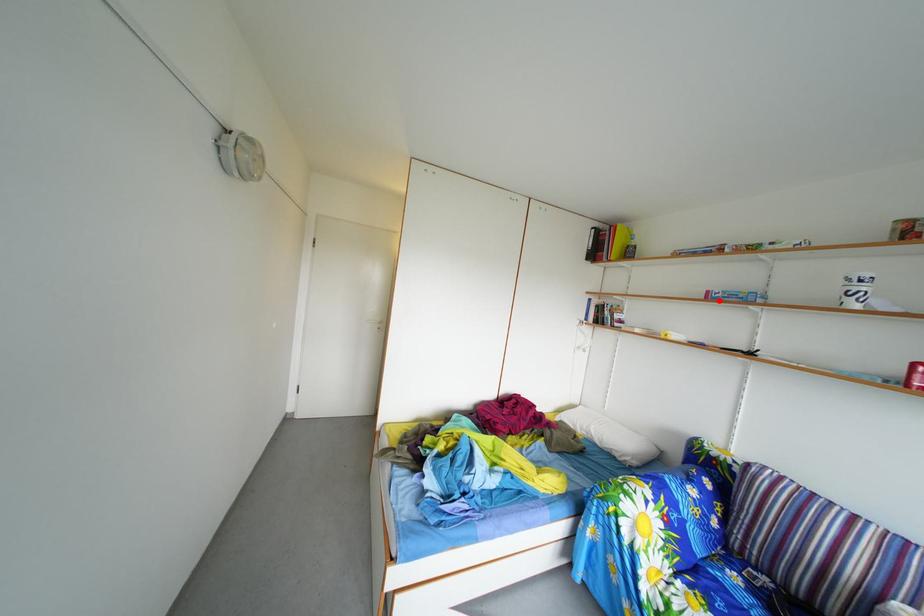
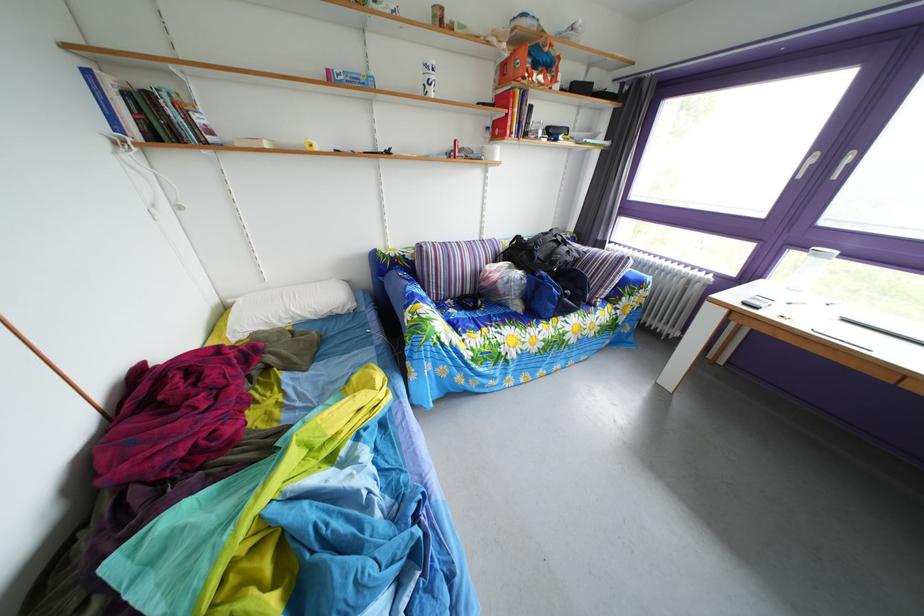
Find the pixel in the second image that matches the highlighted location in the first image.

(339, 79)